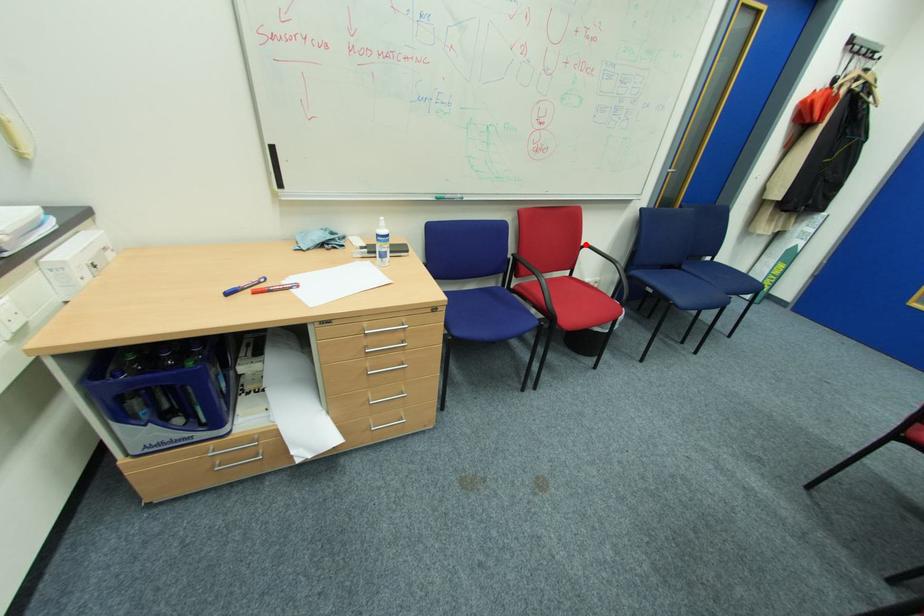
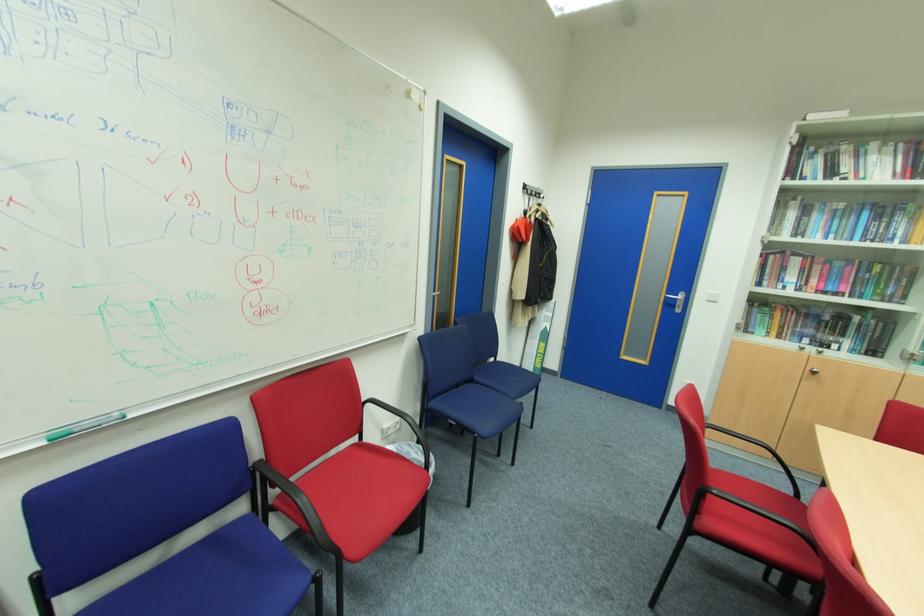
Locate, in the second image, the point that corresponds to the highlighted location in the first image.

(367, 400)